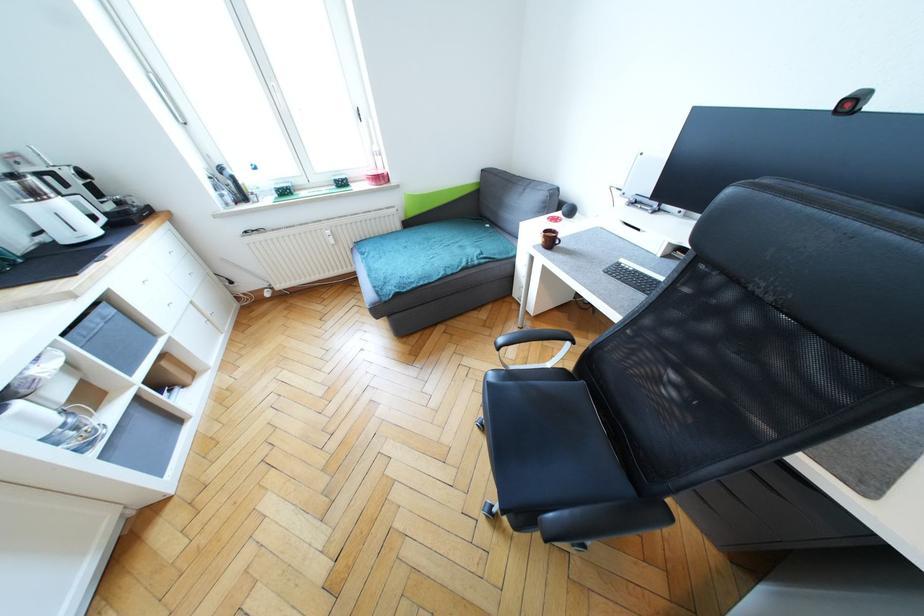
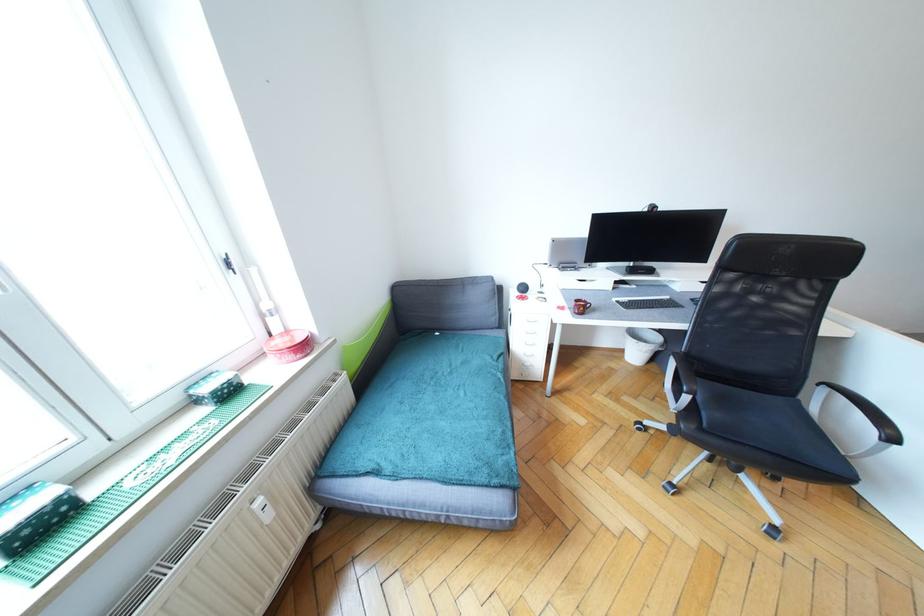
Locate, in the second image, the point that corresponds to [334,241] in the first image.

(272, 517)